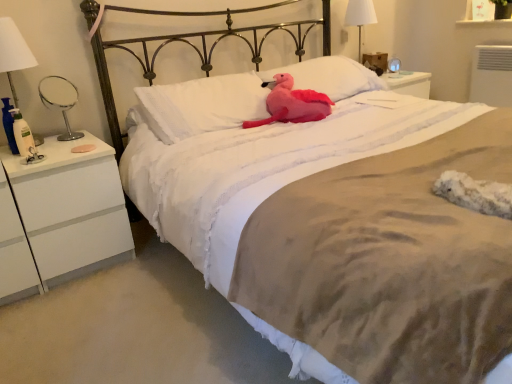
Question: Is white matte/finish nightstand at left in front of or behind fluffy pink plush at center in the image?

Choices:
 (A) front
 (B) behind

Answer: (A)

Question: Is white matte/finish nightstand at left bigger or smaller than fluffy pink plush at center?

Choices:
 (A) big
 (B) small

Answer: (A)

Question: Which object is positioned farthest from the white matte/finish nightstand at left?

Choices:
 (A) white soft pillow at center, which ranks as the 2th pillow in left-to-right order
 (B) white fabric lampshade at upper right
 (C) white soft pillow at center, the second pillow viewed from the right
 (D) fluffy pink plush at center
 (E) metallic silver mirror at left

Answer: (B)

Question: Considering the real-world distances, which object is closest to the white matte/finish nightstand at left?

Choices:
 (A) white soft pillow at center, which ranks as the 2th pillow in left-to-right order
 (B) white soft pillow at center, acting as the 1th pillow starting from the left
 (C) white fabric lampshade at upper right
 (D) fluffy pink plush at center
 (E) metallic silver mirror at left

Answer: (E)